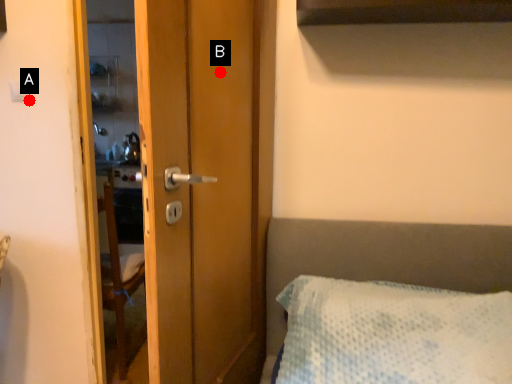
Question: Two points are circled on the image, labeled by A and B beside each circle. Among these points, which one is farthest from the camera?

Choices:
 (A) A is further
 (B) B is further

Answer: (A)